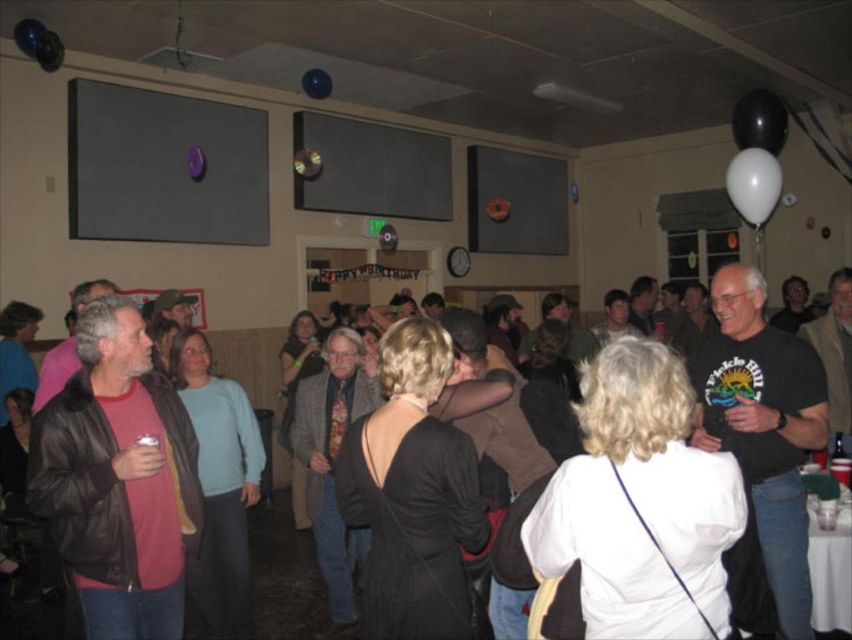
Question: Can you confirm if black leather jacket at center is positioned to the left of shiny blue balloon at upper left?

Choices:
 (A) no
 (B) yes

Answer: (A)

Question: Which is farther from the black rubber balloon at upper right?

Choices:
 (A) shiny blue balloon at upper center
 (B) matte purple balloon at upper left
 (C) shiny blue balloon at upper left

Answer: (C)

Question: Can you confirm if leather jacket at left is thinner than white matte balloon at upper right?

Choices:
 (A) no
 (B) yes

Answer: (A)

Question: Which is nearer to the white matte balloon at upper right?

Choices:
 (A) leather jacket at left
 (B) metallic reflective button at upper center
 (C) purple matte balloon at upper center

Answer: (B)

Question: Which point is closer to the camera?

Choices:
 (A) white matte balloon at upper right
 (B) black rubber balloon at upper right
 (C) leather jacket at left

Answer: (C)

Question: Can you confirm if black leather jacket at center is positioned above purple matte balloon at upper center?

Choices:
 (A) yes
 (B) no

Answer: (B)